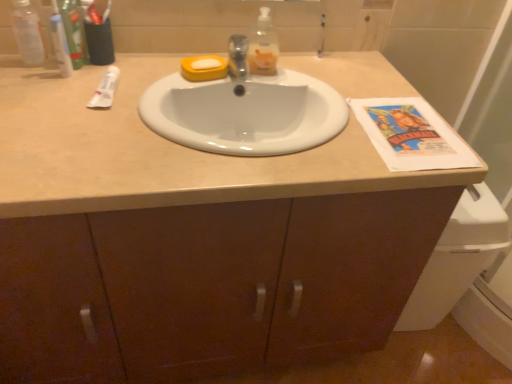
Where is `spots to the right of translucent plastic soap dispenser at upper center, placed as the first bottle when sorted from right to left`? spots to the right of translucent plastic soap dispenser at upper center, placed as the first bottle when sorted from right to left is located at coordinates pyautogui.click(x=313, y=79).